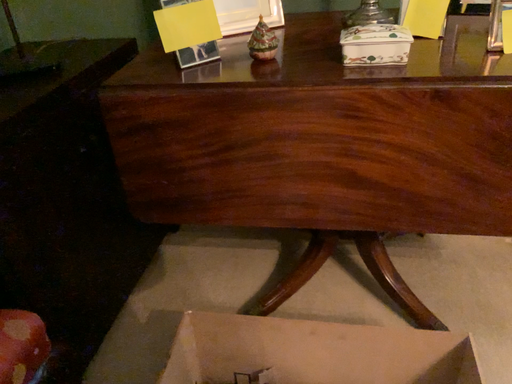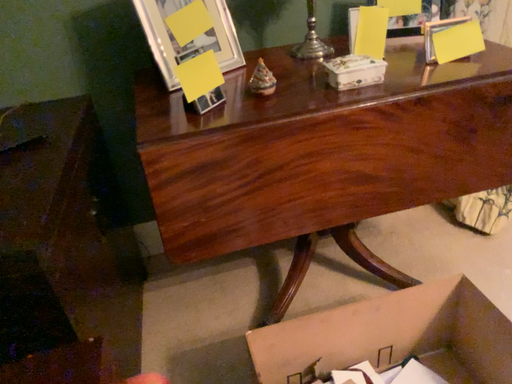
Question: Which way did the camera rotate in the video?

Choices:
 (A) rotated left
 (B) rotated right

Answer: (B)